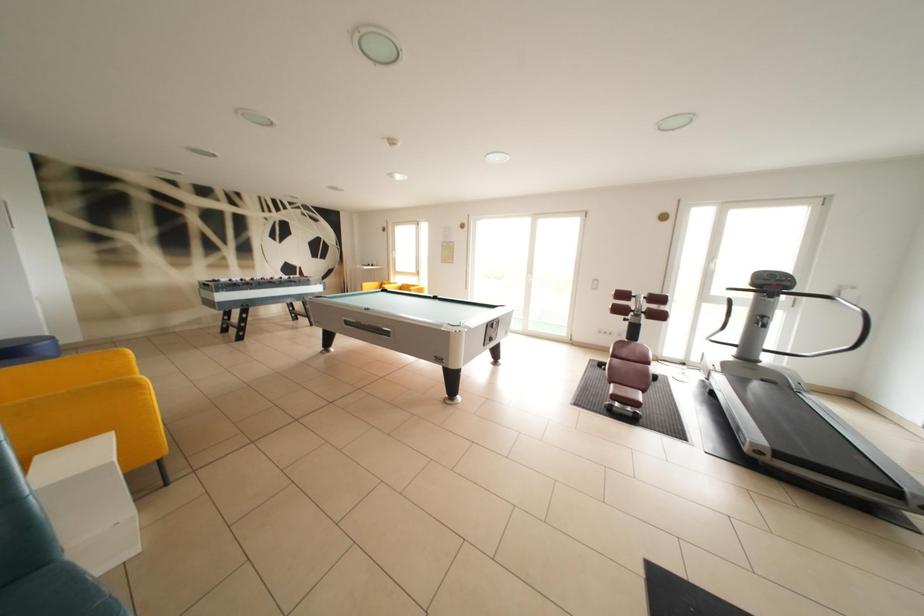
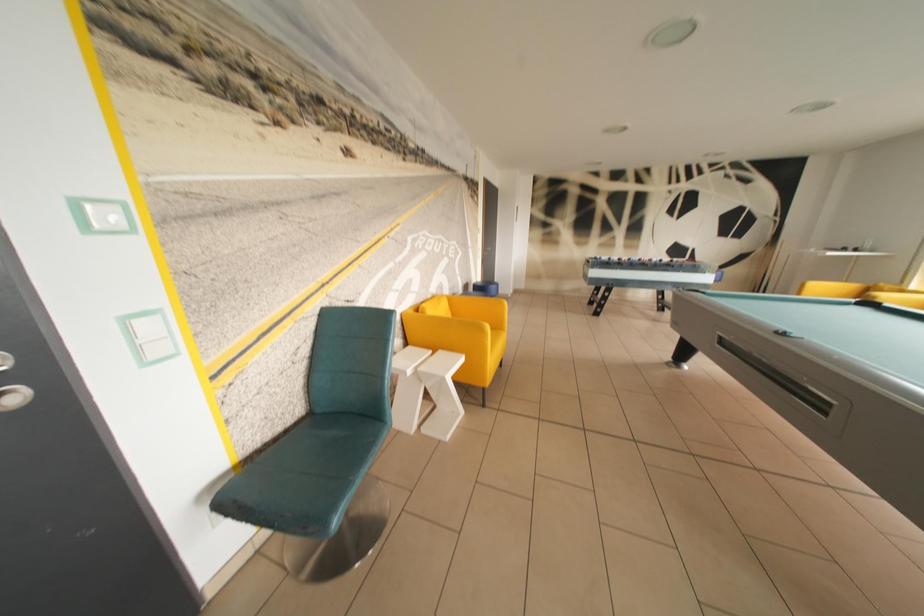
Question: The camera is either moving clockwise (left) or counter-clockwise (right) around the object. The first image is from the beginning of the video and the second image is from the end. Is the camera moving left or right when shooting the video?

Choices:
 (A) Left
 (B) Right

Answer: (B)